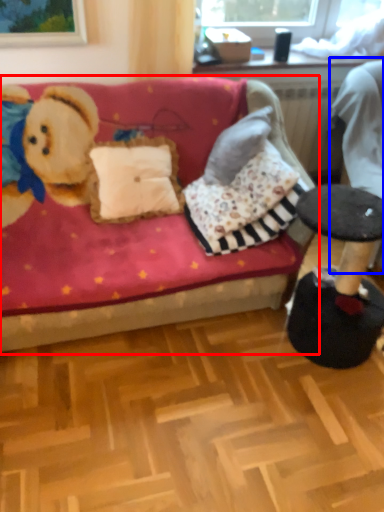
Question: Which point is further to the camera, studio couch (highlighted by a red box) or swivel chair (highlighted by a blue box)?

Choices:
 (A) studio couch
 (B) swivel chair

Answer: (B)